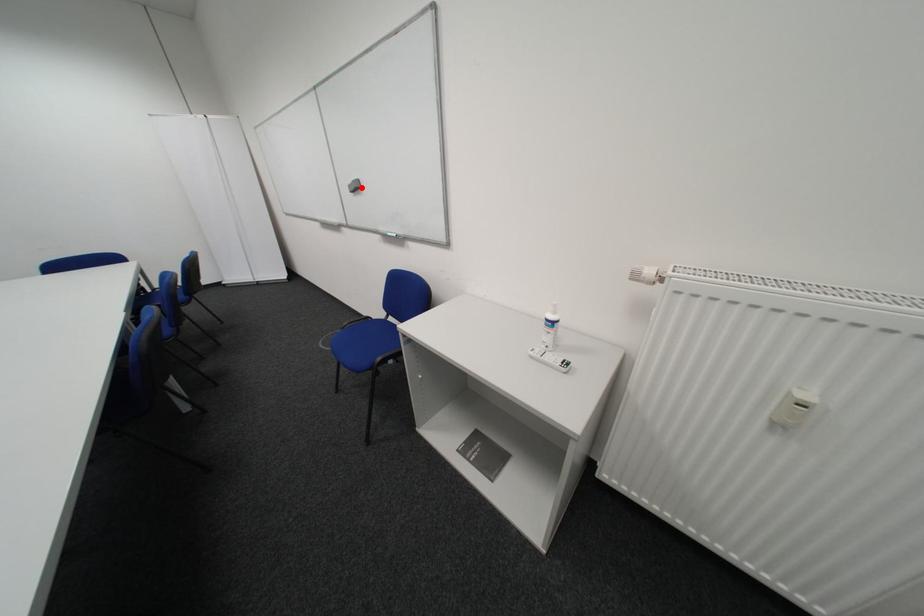
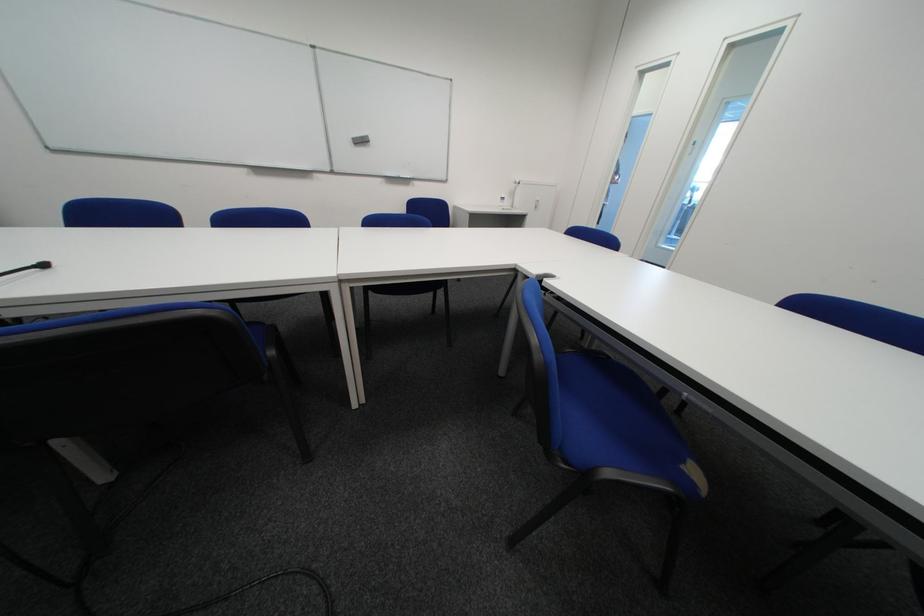
The point at the highlighted location is marked in the first image. Where is the corresponding point in the second image?

(365, 140)